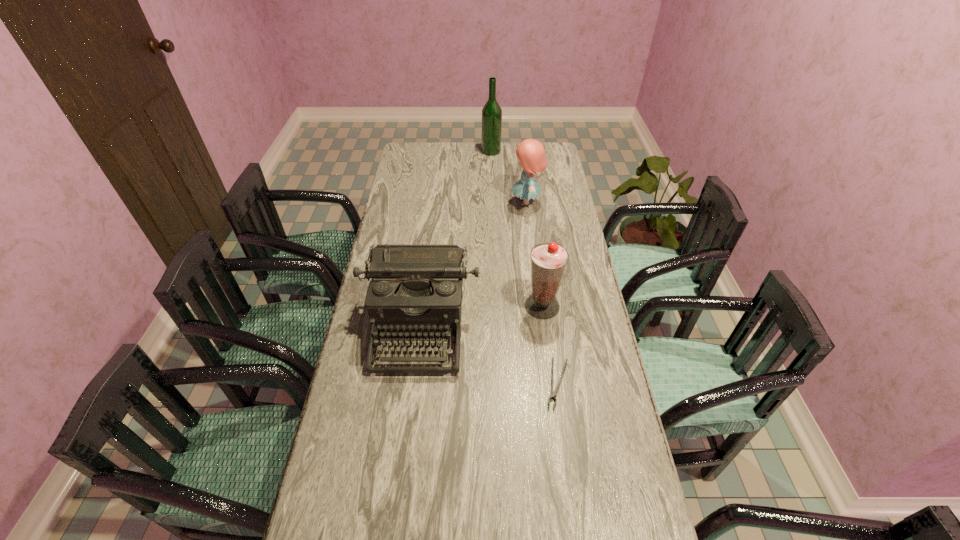
At what (x,y) coordinates should I click in order to perform the action: click on free space that is in between the fourth tallest object and the smoothie. Please return your answer as a coordinate pair (x, y). The width and height of the screenshot is (960, 540). Looking at the image, I should click on (481, 317).

Identify the location of object that ranks as the fourth closest to the doll. (553, 393).

The height and width of the screenshot is (540, 960). What are the coordinates of `object that stands as the third closest to the smoothie` in the screenshot? It's located at coord(531,153).

At what (x,y) coordinates should I click in order to perform the action: click on free space that satisfies the following two spatial constraints: 1. on the front-facing side of the fourth nearest object; 2. on the typing side of the leftmost object. Please return your answer as a coordinate pair (x, y). This screenshot has width=960, height=540. Looking at the image, I should click on (541, 328).

The image size is (960, 540). What are the coordinates of `vacant region that satisfies the following two spatial constraints: 1. on the front-facing side of the smoothie; 2. on the right side of the doll` in the screenshot? It's located at (540, 306).

Identify the location of vacant area that satisfies the following two spatial constraints: 1. on the front-facing side of the doll; 2. on the back side of the smoothie. (540, 306).

Where is `vacant space that satisfies the following two spatial constraints: 1. on the typing side of the shortest object; 2. on the left side of the fourth tallest object`? vacant space that satisfies the following two spatial constraints: 1. on the typing side of the shortest object; 2. on the left side of the fourth tallest object is located at coordinates (413, 383).

Identify the location of vacant space that satisfies the following two spatial constraints: 1. on the front-facing side of the fourth nearest object; 2. on the back side of the smoothie. The width and height of the screenshot is (960, 540). (540, 306).